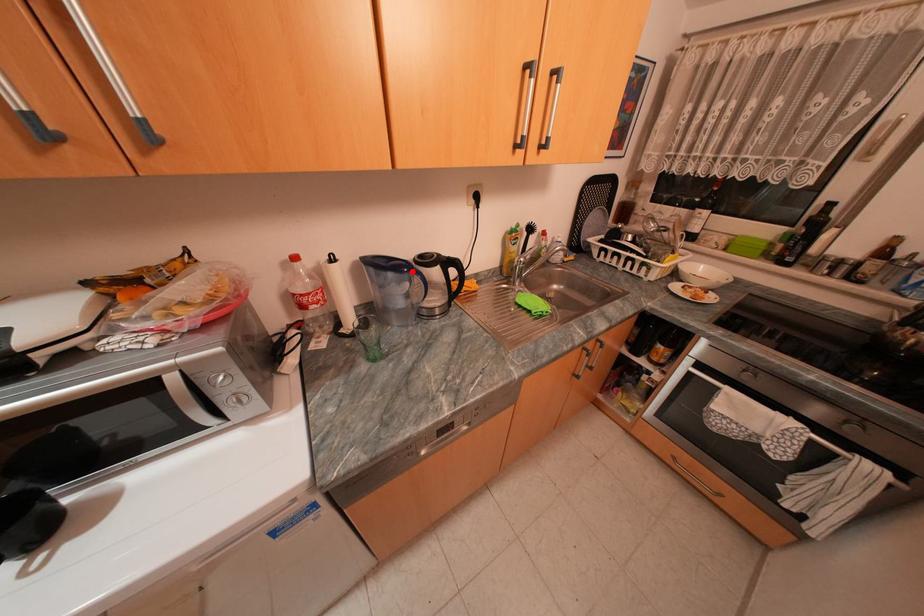
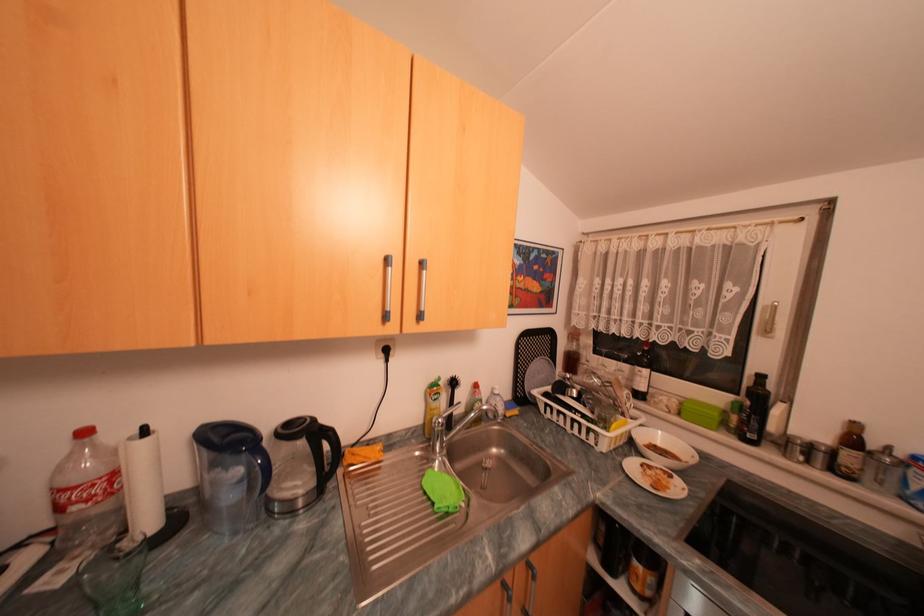
Where in the second image is the point corresponding to the highlighted location from the first image?

(249, 451)